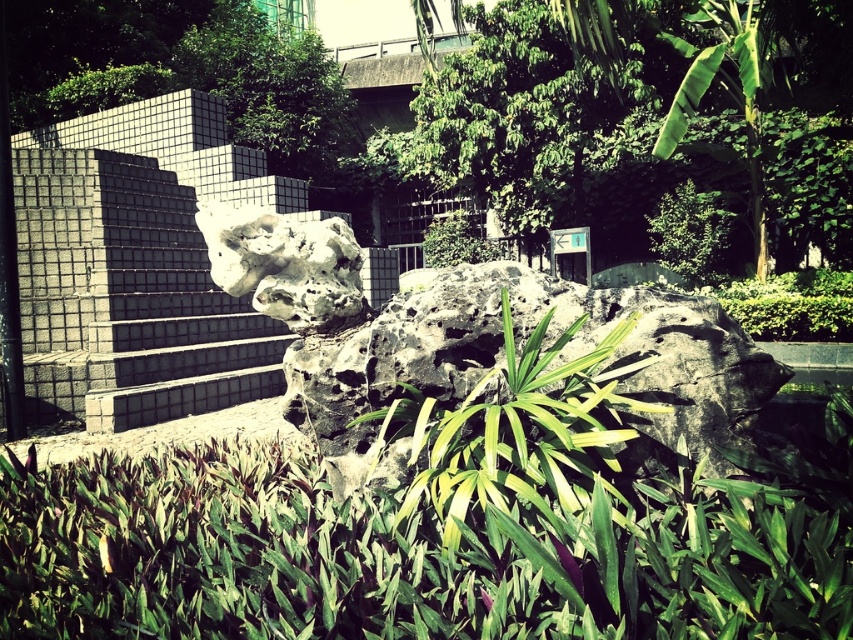
You are designing a garden layout and need to place a new bench between the white stone sculpture at center and the green leafy bush at upper left. Considering their widths, which object should the bench be closer to to ensure it doesn

The white stone sculpture at center has a lesser width compared to the green leafy bush at upper left. Therefore, the bench should be placed closer to the white stone sculpture at center to maintain balance in the garden layout.

You are standing at the base of the steps and want to walk towards the white matte rock at center. Is the green leafy tree at upper center blocking your path?

The green leafy tree at upper center is positioned over the white matte rock at center, so it may block your path when walking towards the rock.